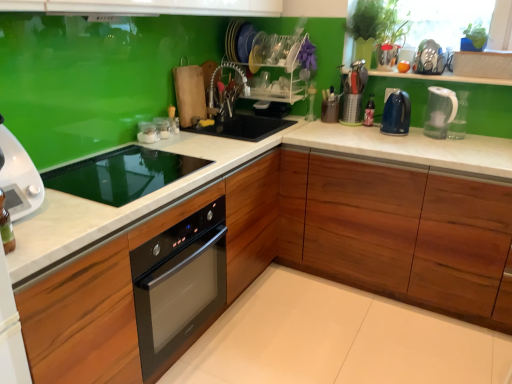
Identify the location of free space to the right of white glossy microwave at left. The width and height of the screenshot is (512, 384). (66, 216).